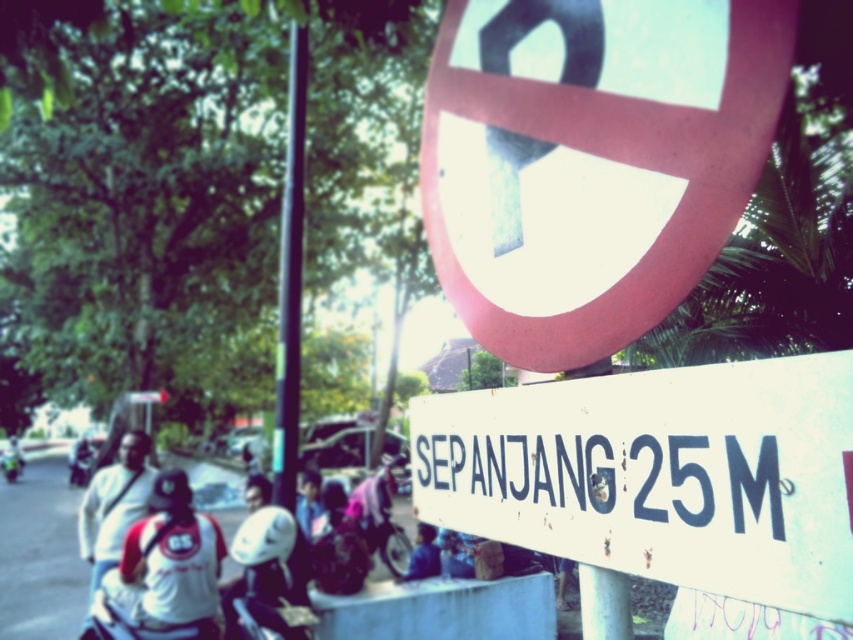
Question: Which is farther from the metallic pole at center?

Choices:
 (A) white matte shirt at left
 (B) blue fabric shirt at center

Answer: (A)

Question: Estimate the real-world distances between objects in this image. Which object is farther from the blue fabric shirt at center?

Choices:
 (A) pink fabric helmet at center
 (B) matte red circle at upper center
 (C) white matte shirt at left
 (D) metallic pole at center

Answer: (B)

Question: Does white fabric shirt at lower left appear on the left side of metallic pole at center?

Choices:
 (A) yes
 (B) no

Answer: (A)

Question: Can you confirm if white plastic sign at center is bigger than white matte shirt at left?

Choices:
 (A) yes
 (B) no

Answer: (A)

Question: Is white plastic sign at center below green matte motorcycle at center?

Choices:
 (A) yes
 (B) no

Answer: (B)

Question: Which point is closer to the camera taking this photo?

Choices:
 (A) (386, 502)
 (B) (508, 324)

Answer: (B)